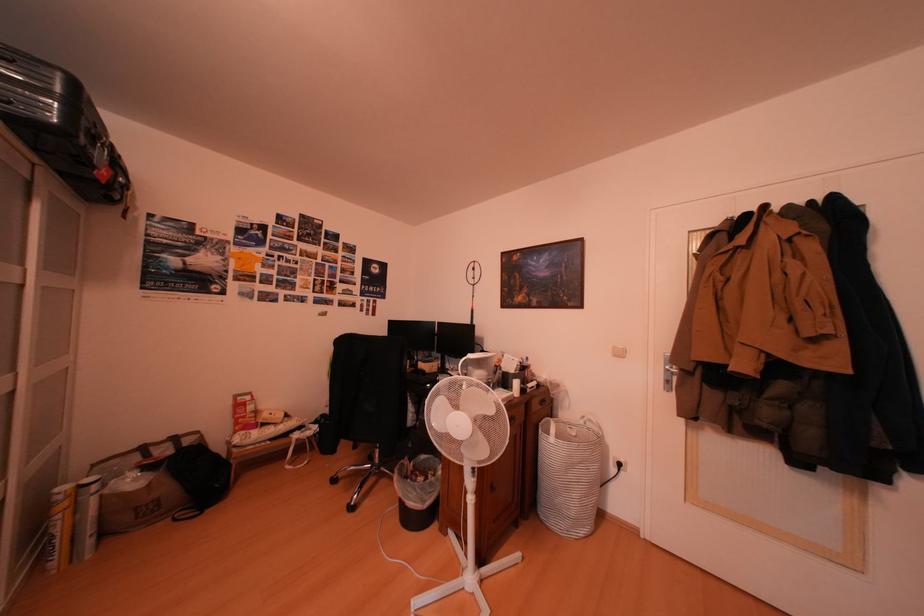
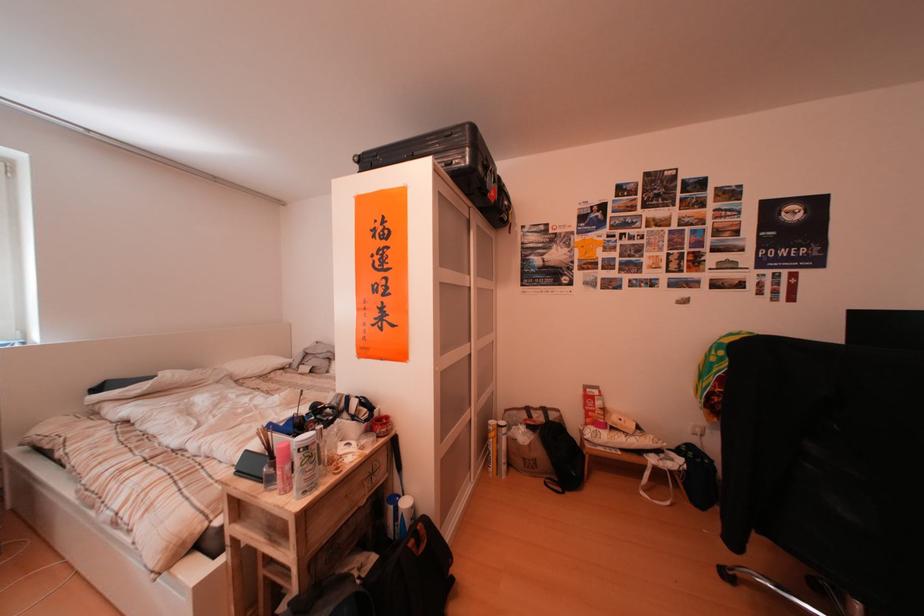
In the second image, find the point that corresponds to the point at 76,511 in the first image.

(505, 440)